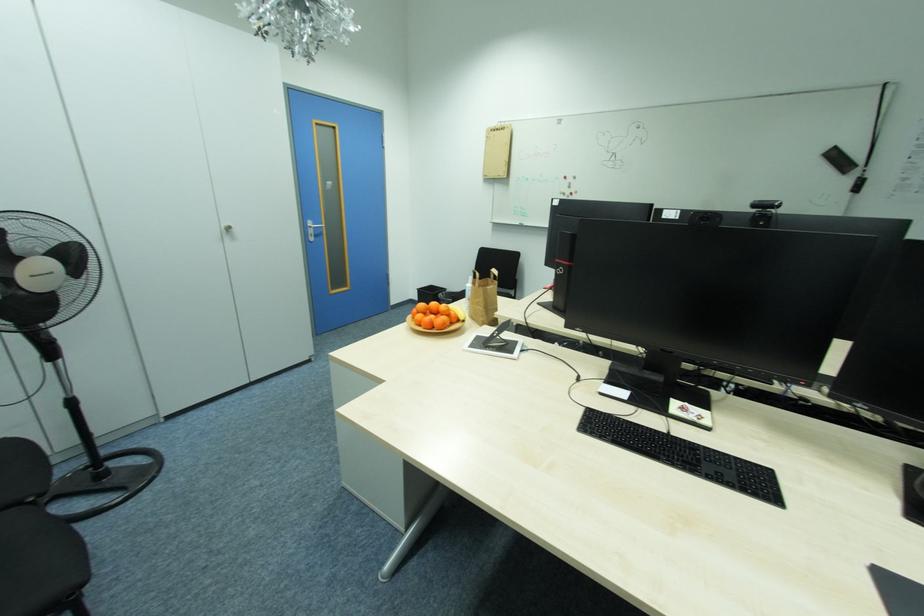
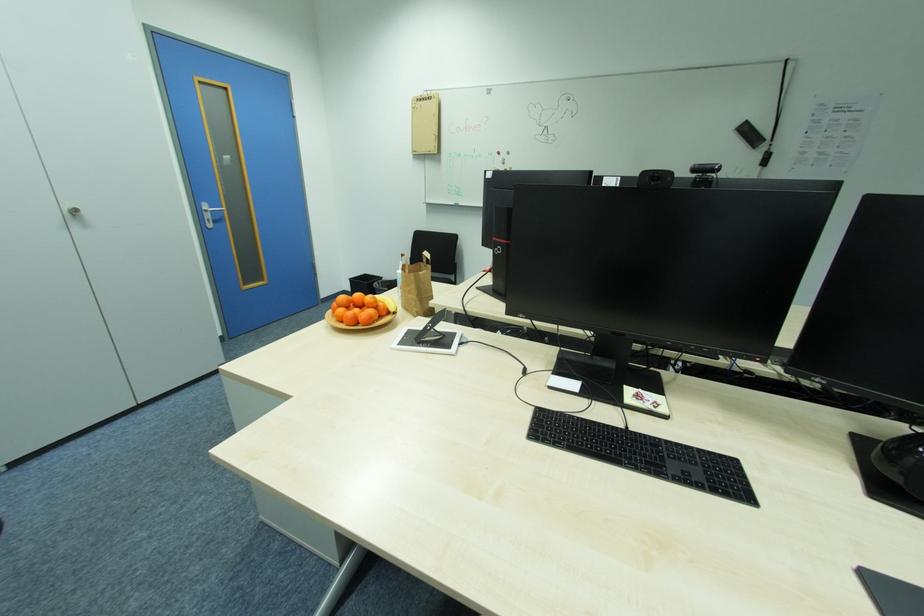
Question: In a continuous first-person perspective shot, in which direction is the camera moving?

Choices:
 (A) Left
 (B) Right
 (C) Forward
 (D) Backward

Answer: (C)